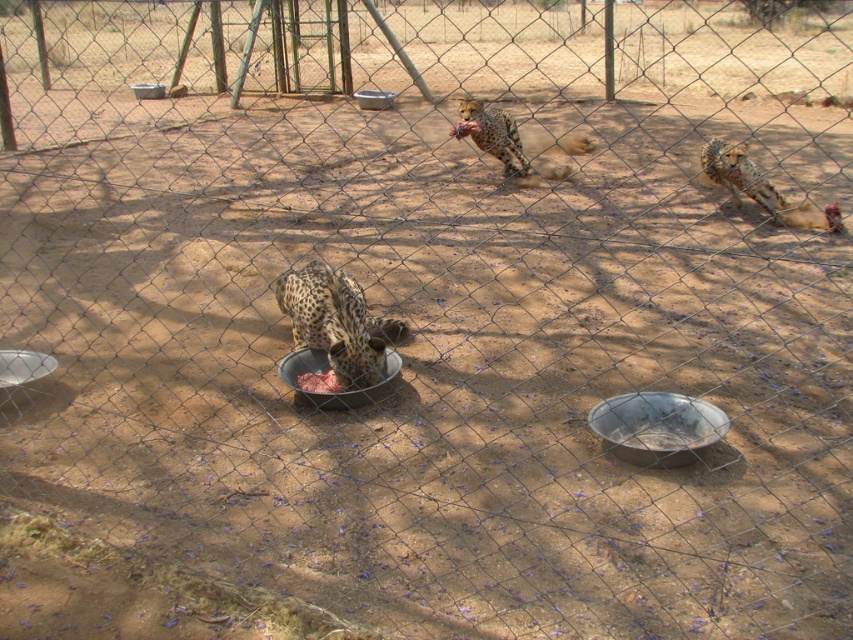
You are a zookeeper who needs to distribute food to the spotted fur cheetah at lower center and the spotted fur cheetah at upper center. Considering their heights, which cheetah requires a lower feeding bowl to reach the food comfortably?

The spotted fur cheetah at lower center has a lesser height compared to the spotted fur cheetah at upper center, so the spotted fur cheetah at lower center requires a lower feeding bowl to reach the food comfortably.

You are a zookeeper standing at the entrance of the enclosure and want to place a new feeding bowl at the point closer to the camera between point (x=329, y=396) and point (x=386, y=104). Which point should you choose?

You should choose point (x=329, y=396) because it is closer to the camera than point (x=386, y=104).